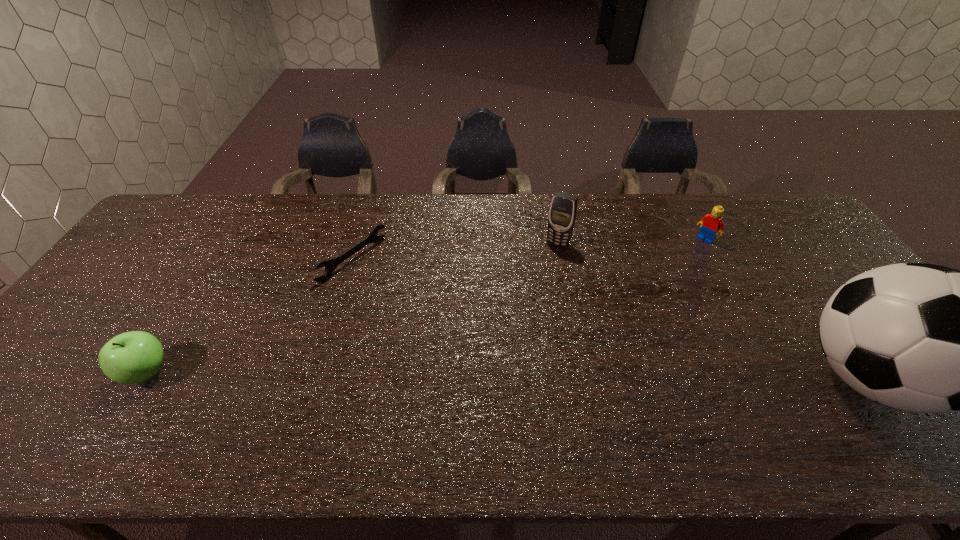
Identify the location of free space at the near edge of the desktop. Image resolution: width=960 pixels, height=540 pixels. (246, 401).

In the image, there is a desktop. At what (x,y) coordinates should I click in order to perform the action: click on vacant space at the right edge. Please return your answer as a coordinate pair (x, y). This screenshot has height=540, width=960. Looking at the image, I should click on (816, 278).

Find the location of a particular element. The height and width of the screenshot is (540, 960). free space at the near left corner of the desktop is located at coordinates point(64,405).

This screenshot has width=960, height=540. I want to click on vacant space that is in between the apple and the second object from right to left, so click(x=426, y=306).

This screenshot has height=540, width=960. Identify the location of unoccupied position between the fourth shortest object and the second object from right to left. (632, 241).

You are a GUI agent. You are given a task and a screenshot of the screen. Output one action in this format:
    pyautogui.click(x=<x>, y=<y>)
    Task: Click on the vacant point located between the Lego and the second tallest object
    
    Given the screenshot: What is the action you would take?
    pyautogui.click(x=632, y=241)

Where is `vacant space in between the Lego and the second object from left to right`? vacant space in between the Lego and the second object from left to right is located at coordinates (529, 249).

You are a GUI agent. You are given a task and a screenshot of the screen. Output one action in this format:
    pyautogui.click(x=<x>, y=<y>)
    Task: Click on the object that is the third closest to the Lego
    
    Given the screenshot: What is the action you would take?
    pyautogui.click(x=330, y=265)

I want to click on the second closest object to the fourth object from left to right, so click(562, 214).